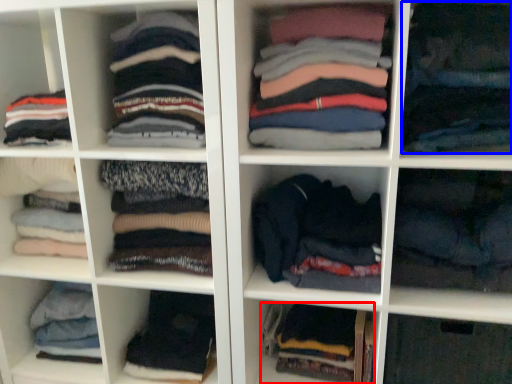
Question: Which point is closer to the camera, clothing (highlighted by a red box) or clothing (highlighted by a blue box)?

Choices:
 (A) clothing
 (B) clothing

Answer: (B)